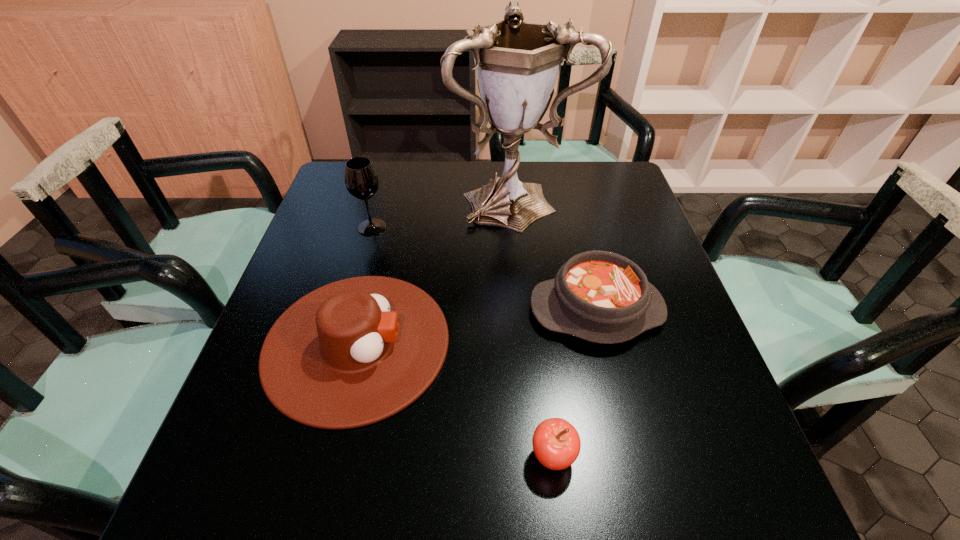
In order to click on trophy cup in this screenshot , I will do `click(517, 63)`.

You are a GUI agent. You are given a task and a screenshot of the screen. Output one action in this format:
    pyautogui.click(x=<x>, y=<y>)
    Task: Click on the wineglass
    This screenshot has width=960, height=540.
    Given the screenshot: What is the action you would take?
    pyautogui.click(x=361, y=180)

At what (x,y) coordinates should I click in order to perform the action: click on cowboy hat. Please return your answer as a coordinate pair (x, y). The width and height of the screenshot is (960, 540). Looking at the image, I should click on (351, 353).

The image size is (960, 540). What are the coordinates of `casserole` in the screenshot? It's located at (599, 296).

Find the location of a particular element. The image size is (960, 540). apple is located at coordinates (556, 443).

Where is `vacant space located on the front of the trophy cup`? vacant space located on the front of the trophy cup is located at coordinates click(526, 322).

Locate an element on the screen. free space located on the back of the fourth shortest object is located at coordinates (390, 164).

Where is `vacant space located 0.050m on the front-facing side of the cowboy hat`? The width and height of the screenshot is (960, 540). vacant space located 0.050m on the front-facing side of the cowboy hat is located at coordinates (472, 343).

Where is `free space located 0.160m on the left of the casserole`? The image size is (960, 540). free space located 0.160m on the left of the casserole is located at coordinates (459, 310).

This screenshot has height=540, width=960. Identify the location of vacant space positioned 0.320m on the left of the nearest object. (346, 456).